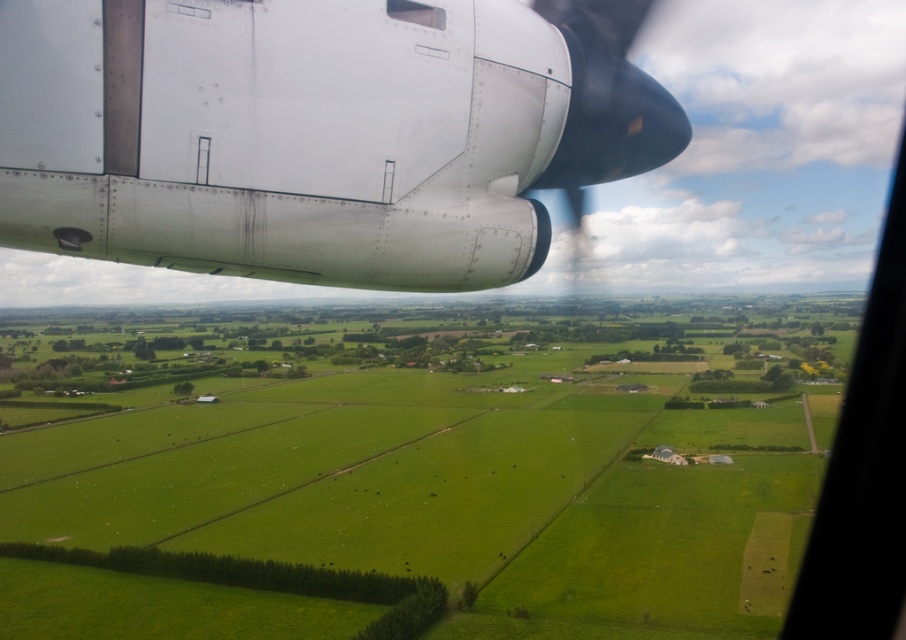
You are a drone operator trying to capture a photo of the point at coordinates point (334, 129) from the aircraft window. If your drone can fly up to 4 meters away from the window, will it be able to reach the point?

The point (334, 129) is 3.56 meters away from the camera, so yes, the drone can reach it since its maximum range of 4 meters is greater than the required distance.

You are a passenger sitting in the aircraft and want to take a photo of the green farmland outside. You have a camera with a lens that can only focus on objects within 1 meter of the transparent plastic airplane window at upper center. Considering the metallic silver airplane engine at upper left is blocking part of the view, will you be able to capture the entire green farmland in your photo?

The metallic silver airplane engine at upper left is taller than the transparent plastic airplane window at upper center. Since the engine is blocking part of the window, you won the entire green farmland in your photo due to the obstruction.